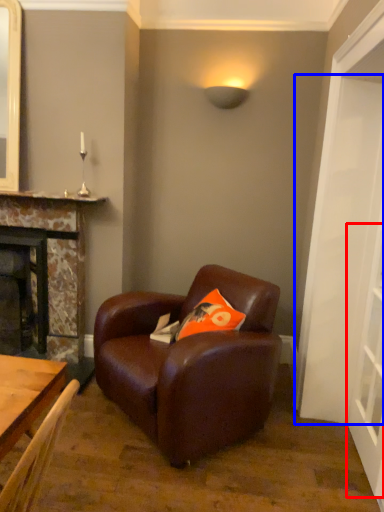
Question: Which point is closer to the camera, glass door (highlighted by a red box) or door (highlighted by a blue box)?

Choices:
 (A) glass door
 (B) door

Answer: (B)